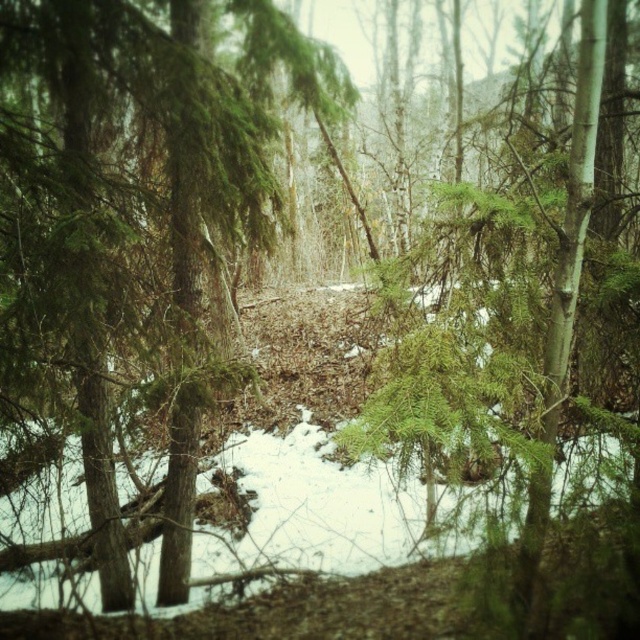
Where is `green needle-like tree at center`? Image resolution: width=640 pixels, height=640 pixels. green needle-like tree at center is located at coordinates (128, 227).

Which is in front, point (188, 416) or point (573, 145)?

Point (573, 145) is more forward.

Where is `green needle-like tree at center`? This screenshot has height=640, width=640. green needle-like tree at center is located at coordinates (128, 227).